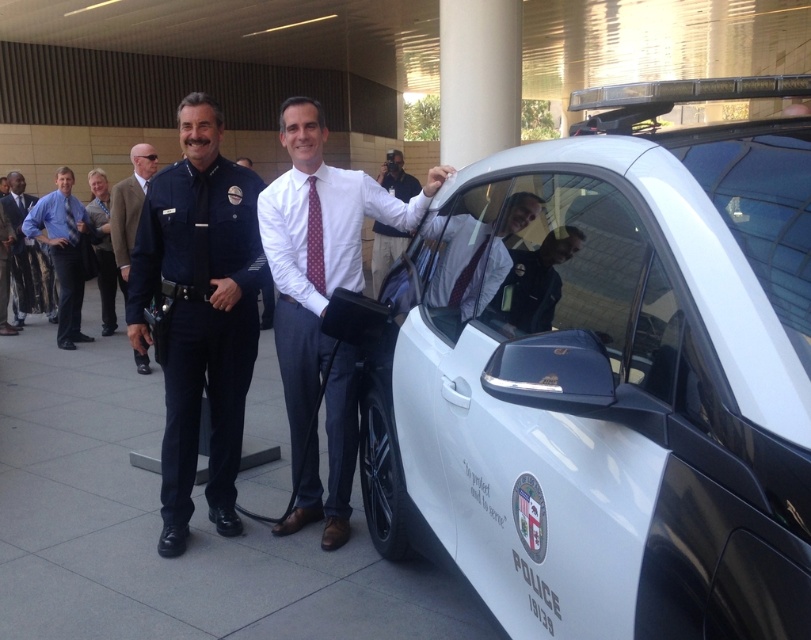
Is point (290, 324) more distant than point (67, 317)?

No, it is in front of (67, 317).

Does white glossy suit at center come in front of blue shirt at left?

Yes, white glossy suit at center is closer to the viewer.

Is point (339, 204) positioned in front of point (75, 326)?

Yes.

Locate an element on the screen. This screenshot has width=811, height=640. white glossy suit at center is located at coordinates (320, 300).

Is leather jacket at left taller than light brown leather jacket at center?

Indeed, leather jacket at left has a greater height compared to light brown leather jacket at center.

Who is more forward, (14, 323) or (101, 188)?

Point (101, 188)

Who is more forward, (33, 278) or (103, 188)?

Point (103, 188) is more forward.

I want to click on leather jacket at left, so click(x=28, y=259).

Can you confirm if light brown leather jacket at center is positioned below white shirt at center?

Indeed, light brown leather jacket at center is positioned under white shirt at center.

Between light brown leather jacket at center and white shirt at center, which one has more height?

With more height is light brown leather jacket at center.

What do you see at coordinates (103, 250) in the screenshot?
I see `light brown leather jacket at center` at bounding box center [103, 250].

Locate an element on the screen. This screenshot has width=811, height=640. light brown leather jacket at center is located at coordinates (103, 250).